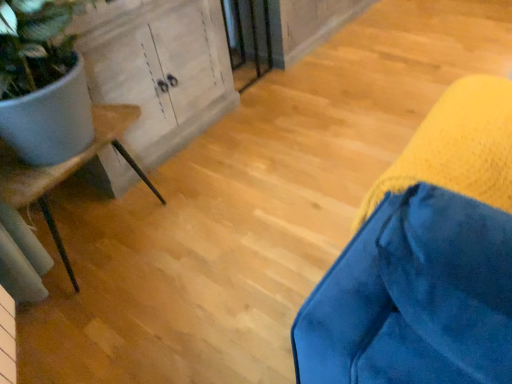
Identify the location of free spot in front of white matte plant pot at left, which is the second furniture from front to back. (121, 328).